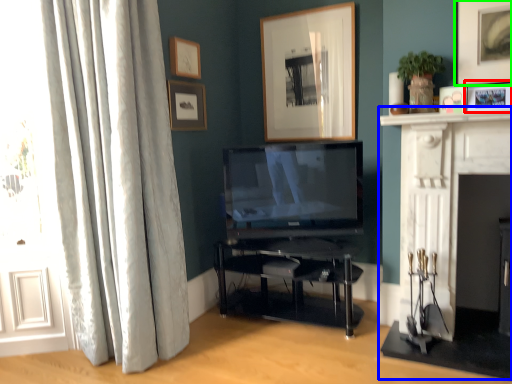
Question: Which object is positioned farthest from picture frame (highlighted by a red box)? Select from fireplace (highlighted by a blue box) and picture frame (highlighted by a green box).

Choices:
 (A) fireplace
 (B) picture frame

Answer: (A)